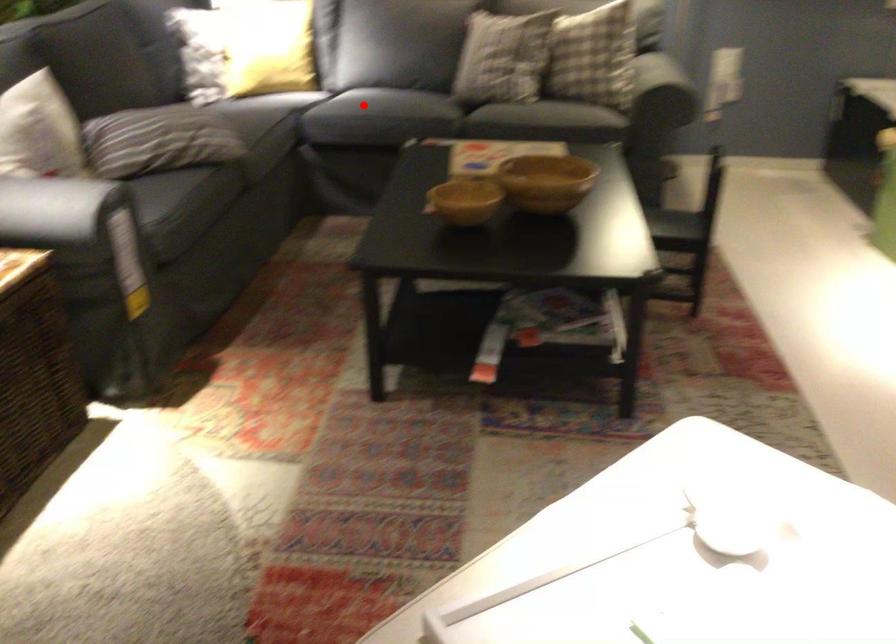
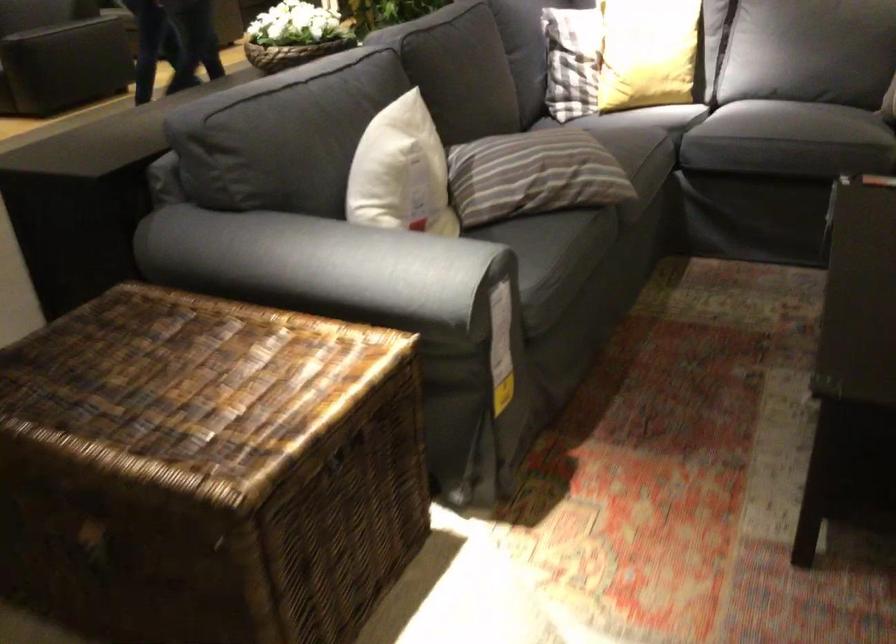
Where in the second image is the point corresponding to the highlighted location from the first image?

(768, 122)